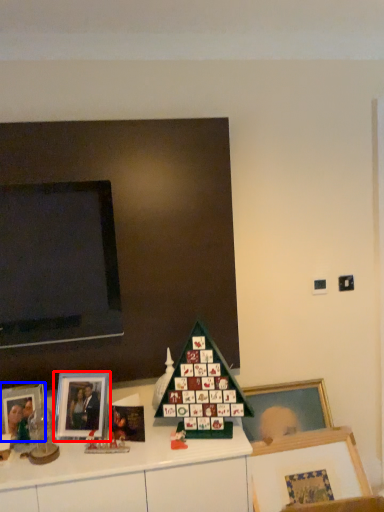
Question: Which object is further to the camera taking this photo, picture frame (highlighted by a red box) or picture frame (highlighted by a blue box)?

Choices:
 (A) picture frame
 (B) picture frame

Answer: (A)